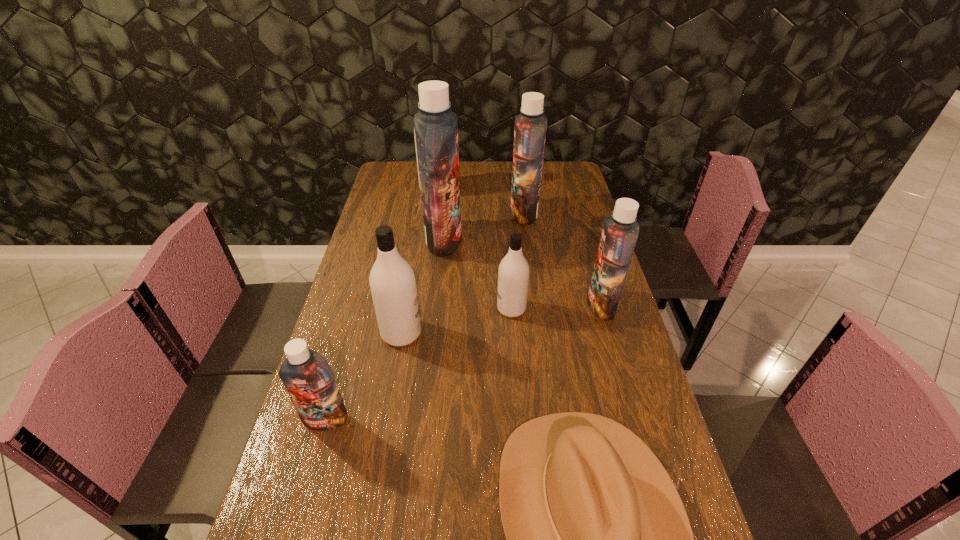
Identify the location of empty space that is in between the third smallest blue shampoo and the rightmost blue shampoo. This screenshot has height=540, width=960. (563, 259).

You are a GUI agent. You are given a task and a screenshot of the screen. Output one action in this format:
    pyautogui.click(x=<x>, y=<y>)
    Task: Click on the vacant area that lies between the second smallest white shampoo and the leftmost shampoo
    The width and height of the screenshot is (960, 540).
    Given the screenshot: What is the action you would take?
    pyautogui.click(x=364, y=376)

Locate an element on the screen. free space between the tallest object and the smallest white shampoo is located at coordinates (477, 274).

I want to click on vacant space that's between the second biggest white shampoo and the rightmost white shampoo, so click(x=457, y=321).

This screenshot has height=540, width=960. I want to click on vacant area between the second biggest blue shampoo and the rightmost shampoo, so click(563, 259).

Identify the location of free area in between the third blue shampoo from left to right and the farthest object. Image resolution: width=960 pixels, height=540 pixels. (481, 201).

Point out which object is positioned as the seventh nearest to the rightmost shampoo. Please provide its 2D coordinates. Your answer should be formatted as a tuple, i.e. [(x, y)], where the tuple contains the x and y coordinates of a point satisfying the conditions above.

[(309, 380)]

Choose which object is the second nearest neighbor to the tallest shampoo. Please provide its 2D coordinates. Your answer should be formatted as a tuple, i.e. [(x, y)], where the tuple contains the x and y coordinates of a point satisfying the conditions above.

[(530, 125)]

Where is `shampoo that is the sixth closest one to the smallest white shampoo`? Image resolution: width=960 pixels, height=540 pixels. shampoo that is the sixth closest one to the smallest white shampoo is located at coordinates (428, 77).

Find the location of a particular element. The image size is (960, 540). shampoo identified as the third closest to the nearest blue shampoo is located at coordinates (436, 127).